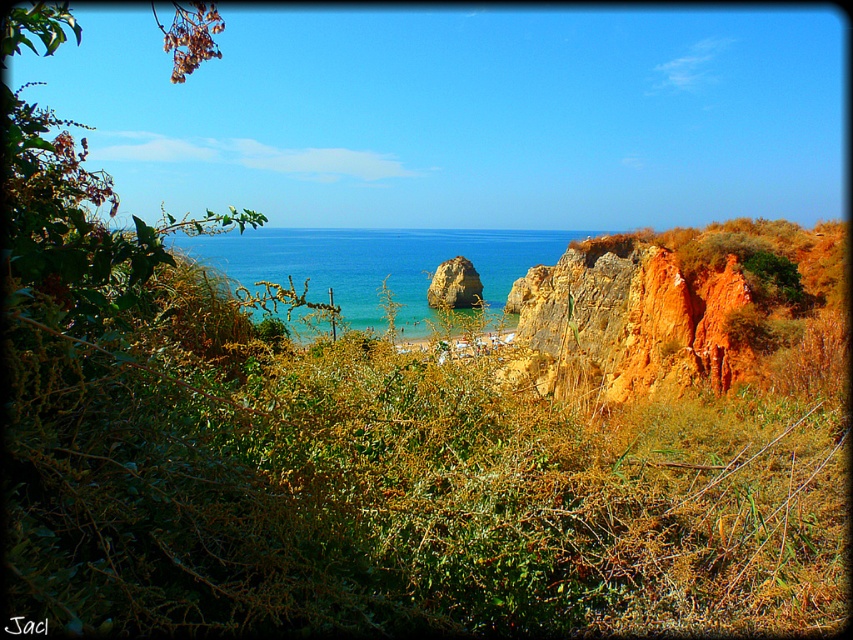
You are standing on the beach and want to walk to the orange rock at center. Which direction should you head towards from the blue clear water at center?

You should head to the right from the blue clear water at center to reach the orange rock at center since the blue clear water at center is to the left of the orange rock at center.

You are a photographer planning to capture a sunset shot at this coastal location. You want to ensure that both the blue clear water at center and the orange rock at center are visible in the frame. Based on their positions, which object will appear larger in your photo?

The blue clear water at center will appear larger in the photo because it is much taller than the orange rock at center.